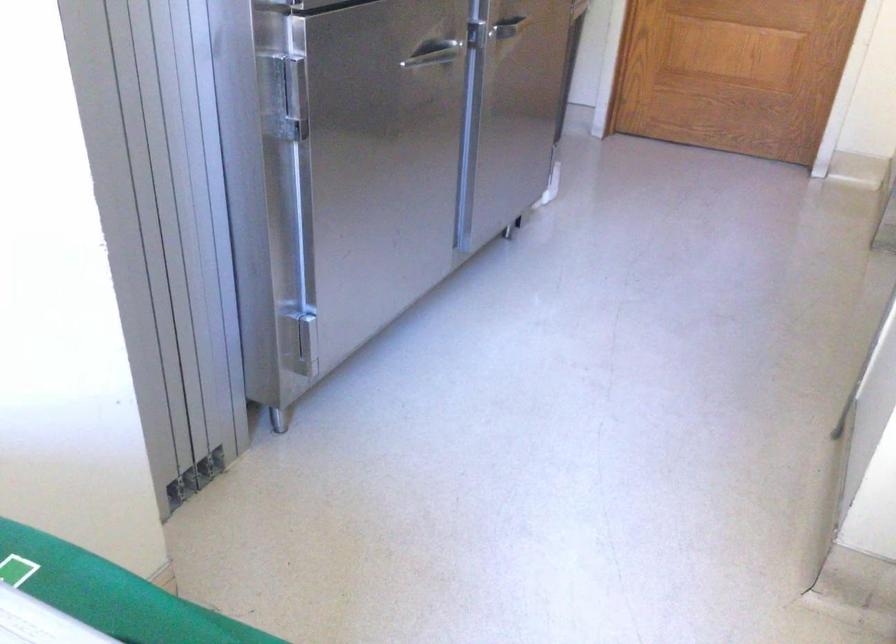
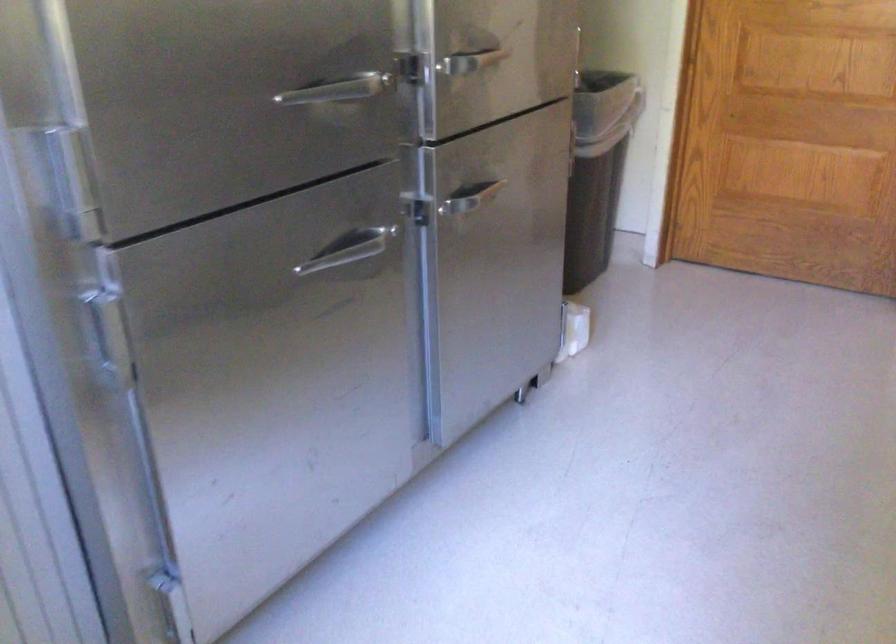
The images are taken continuously from a first-person perspective. In which direction are you moving?

The cameraman moved toward right, forward.